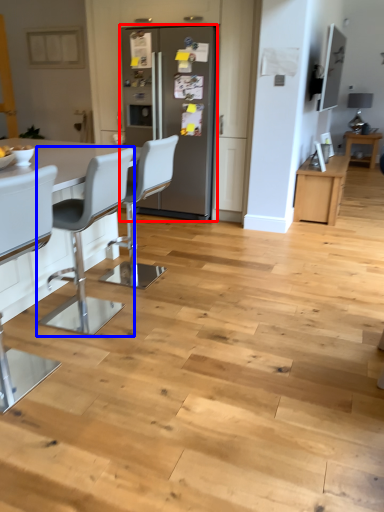
Question: Which of the following is the closest to the observer, fridge (highlighted by a red box) or chair (highlighted by a blue box)?

Choices:
 (A) fridge
 (B) chair

Answer: (B)